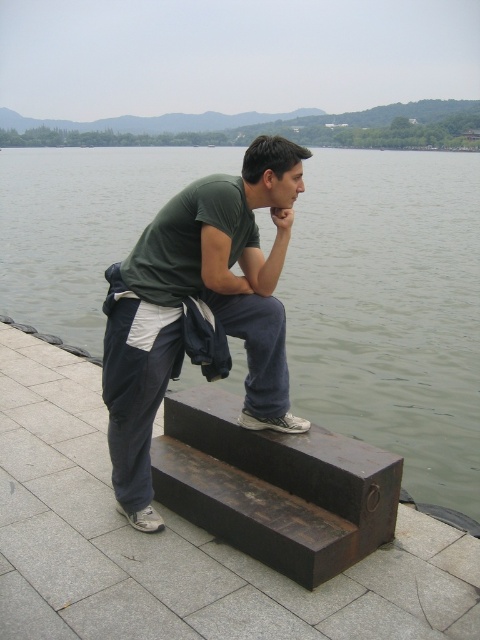
Is point (292, 324) less distant than point (144, 608)?

No, (292, 324) is further to viewer.

Locate an element on the screen. The height and width of the screenshot is (640, 480). green water at upper center is located at coordinates (391, 310).

Is dark brown wood at lower center above dark brown wood at center?

No.

Can you confirm if dark brown wood at lower center is positioned to the left of dark brown wood at center?

Correct, you'll find dark brown wood at lower center to the left of dark brown wood at center.

The height and width of the screenshot is (640, 480). What do you see at coordinates (179, 544) in the screenshot?
I see `dark brown wood at lower center` at bounding box center [179, 544].

At what (x,y) coordinates should I click in order to perform the action: click on dark brown wood at lower center. Please return your answer as a coordinate pair (x, y). The width and height of the screenshot is (480, 640). Looking at the image, I should click on (179, 544).

Between green water at upper center and matte green t-shirt at center, which one is positioned higher?

green water at upper center

Consider the image. Does green water at upper center appear over matte green t-shirt at center?

Yes.

Where is `green water at upper center`? green water at upper center is located at coordinates (391, 310).

I want to click on green water at upper center, so click(391, 310).